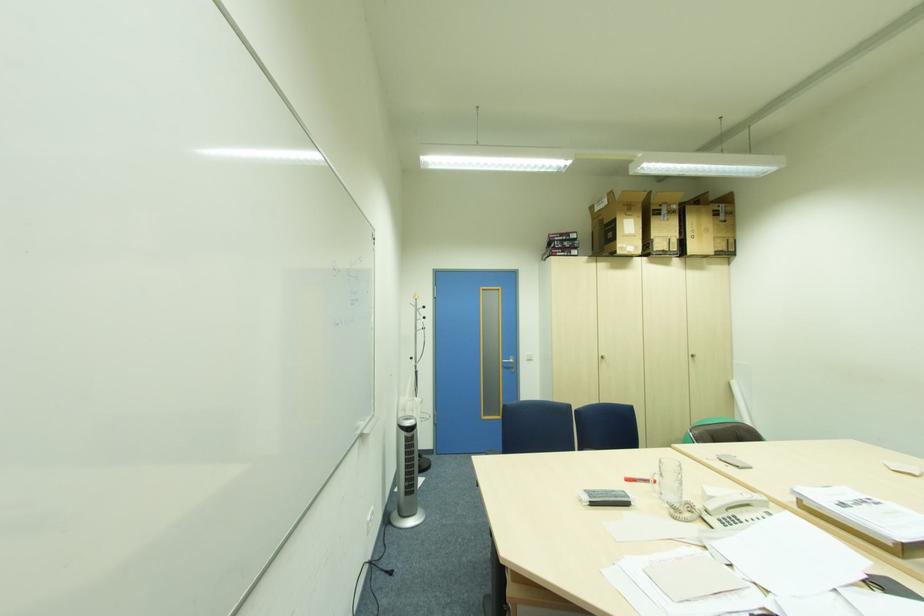
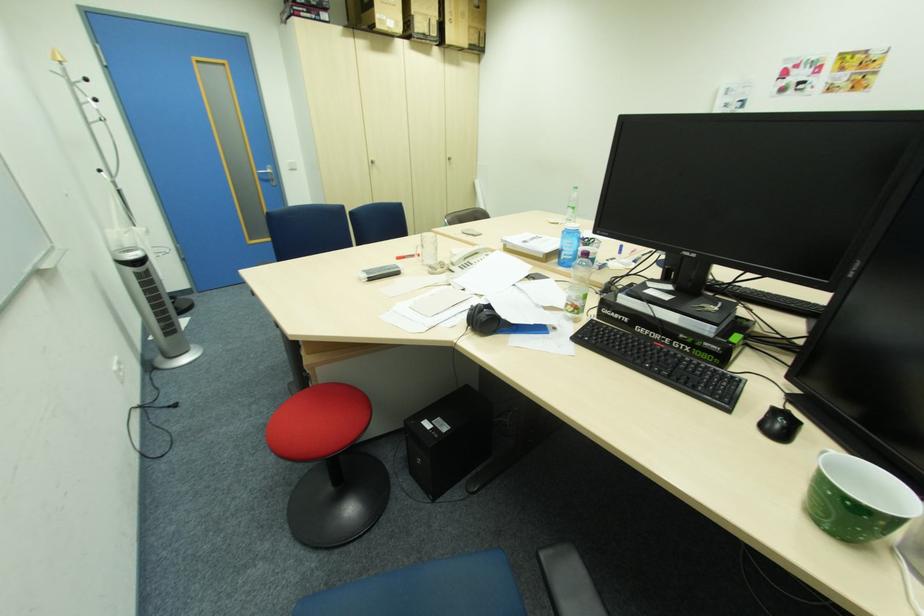
Find the pixel in the second image that matches (699,357) in the first image.

(456, 159)